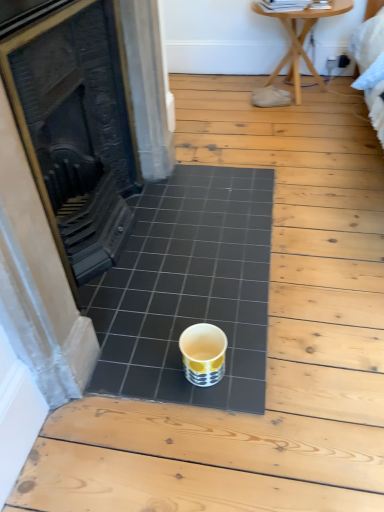
Identify the location of free space to the left of yellow and white ceramic cup at center. (142, 365).